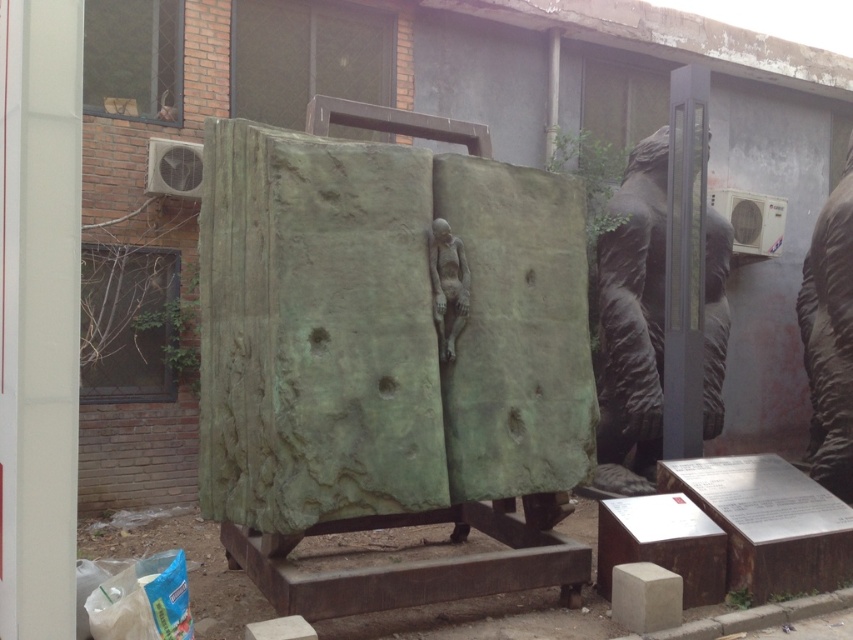
You are an art student standing in front of the sculpture installation. You want to take a photo of both the bronze statue at right and the bronze statue at center. However, you can only focus on one statue at a time. Which statue should you focus on first to ensure it appears larger in your photo?

You should focus on the bronze statue at right first because it is closer to you than the bronze statue at center, making it appear larger in the photo.

You are an art curator planning to move the green stone statue at right and the bronze statue at center to a new gallery space. The gallery has a height restriction of 2 meters. Can both statues be moved without any modifications?

The green stone statue at right is taller than the bronze statue at center. Since the height restriction is 2 meters, if the bronze statue at center is under 2 meters, the green stone statue at right might exceed the height limit. However, without knowing the exact height of the bronze statue at center, it is impossible to determine if both can be moved without modifications.

You are an art curator planning to install a new sculpture that is 2 meters tall. You want to place it near the existing sculptures in the image. Considering the bronze statue at right and the green stone statue at right, which one should you place your new sculpture next to to maintain visual harmony?

The bronze statue at right is taller than the green stone statue at right. To maintain visual harmony, place the new 2 meter tall sculpture next to the bronze statue at right since it is already taller and closer in scale.